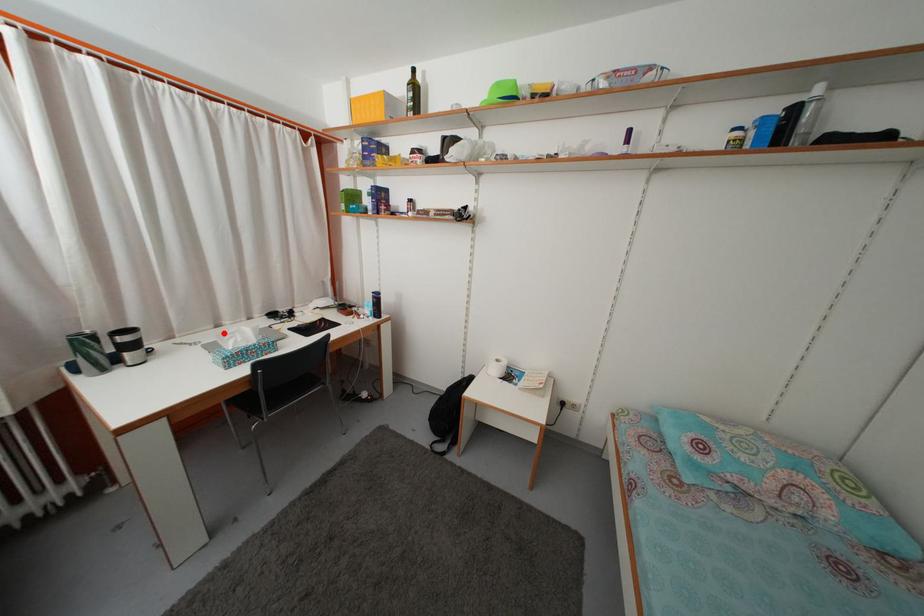
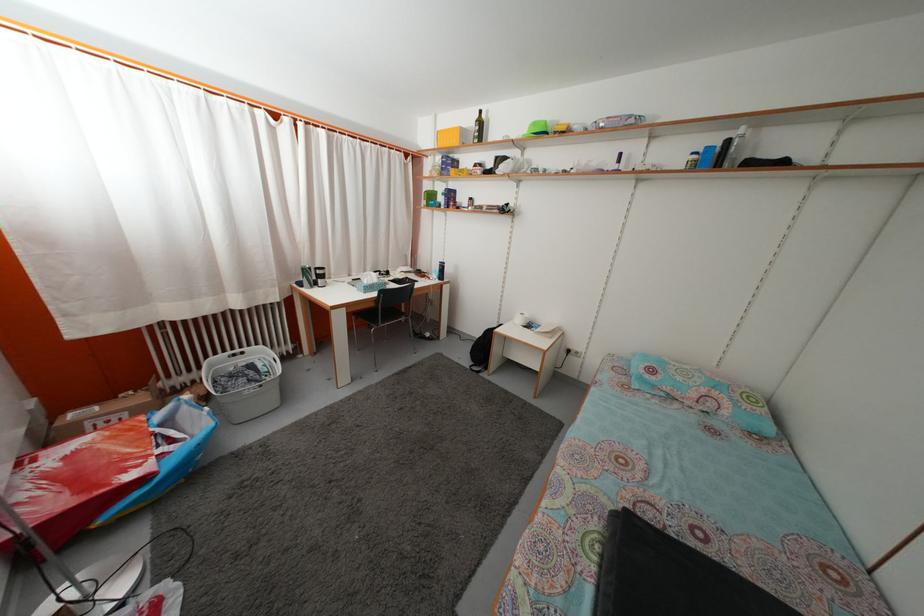
Question: I am providing you with two images of the same scene from different viewpoints. Image1 has a red point marked. In image2, the corresponding 3D location appears at what relative position? Reply with the corresponding letter.

Choices:
 (A) Closer
 (B) Farther

Answer: (A)